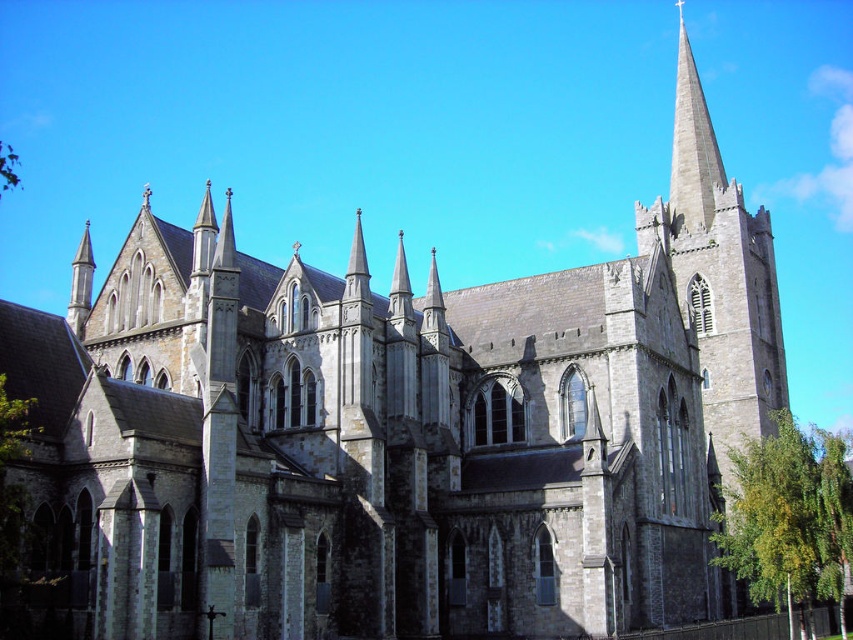
Which is in front, point (747, 518) or point (686, 92)?

Positioned in front is point (747, 518).

Who is lower down, green leafy tree at lower right or gray stone spire at upper right?

green leafy tree at lower right is lower down.

Measure the distance between point [758,529] and camera.

197.66 feet

Where is `green leafy tree at lower right`? The width and height of the screenshot is (853, 640). green leafy tree at lower right is located at coordinates (788, 516).